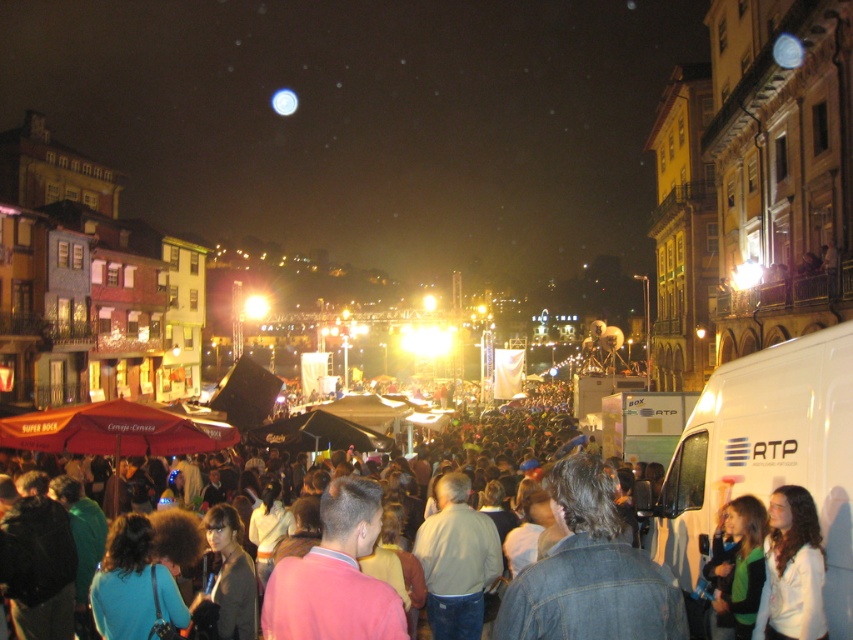
Does white matte jacket at lower right come behind green fleece jacket at lower right?

No, it is not.

Can you confirm if white matte jacket at lower right is wider than green fleece jacket at lower right?

In fact, white matte jacket at lower right might be narrower than green fleece jacket at lower right.

Is point (769, 545) closer to camera compared to point (764, 518)?

Yes, it is in front of point (764, 518).

Locate an element on the screen. white matte jacket at lower right is located at coordinates (791, 570).

Is denim jacket at lower right bigger than white matte jacket at lower right?

Indeed, denim jacket at lower right has a larger size compared to white matte jacket at lower right.

Can you confirm if denim jacket at lower right is shorter than white matte jacket at lower right?

Incorrect, denim jacket at lower right's height does not fall short of white matte jacket at lower right's.

Between point (619, 612) and point (798, 541), which one is positioned in front?

Point (619, 612)

Where is `denim jacket at lower right`? The width and height of the screenshot is (853, 640). denim jacket at lower right is located at coordinates (589, 572).

Does green fleece jacket at lower right have a larger size compared to denim jacket at center?

Actually, green fleece jacket at lower right might be smaller than denim jacket at center.

Is green fleece jacket at lower right positioned in front of denim jacket at center?

No.

Find the location of a particular element. This screenshot has height=640, width=853. green fleece jacket at lower right is located at coordinates (738, 566).